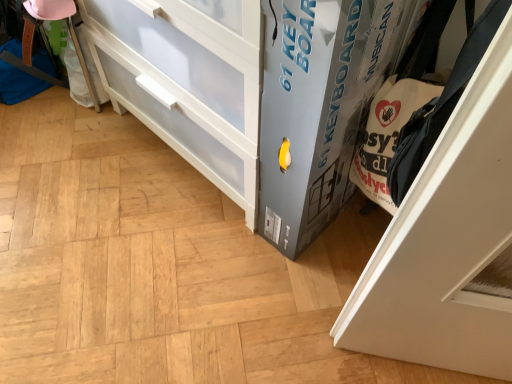
Question: Is white matte door at right at the right side of gray cardboard box at lower right?

Choices:
 (A) yes
 (B) no

Answer: (A)

Question: Does white matte door at right have a greater width compared to gray cardboard box at lower right?

Choices:
 (A) no
 (B) yes

Answer: (A)

Question: Considering the relative positions of white matte door at right and gray cardboard box at lower right in the image provided, is white matte door at right in front of gray cardboard box at lower right?

Choices:
 (A) no
 (B) yes

Answer: (B)

Question: Considering the relative sizes of white matte door at right and gray cardboard box at lower right in the image provided, is white matte door at right smaller than gray cardboard box at lower right?

Choices:
 (A) yes
 (B) no

Answer: (A)

Question: Does white matte door at right turn towards gray cardboard box at lower right?

Choices:
 (A) no
 (B) yes

Answer: (A)

Question: Is white matte door at right thinner than gray cardboard box at lower right?

Choices:
 (A) no
 (B) yes

Answer: (B)

Question: From a real-world perspective, is gray cardboard box at lower right located higher than white matte door at right?

Choices:
 (A) yes
 (B) no

Answer: (B)

Question: Is gray cardboard box at lower right behind white matte door at right?

Choices:
 (A) no
 (B) yes

Answer: (B)

Question: Can you confirm if gray cardboard box at lower right is wider than white matte door at right?

Choices:
 (A) yes
 (B) no

Answer: (A)

Question: Does gray cardboard box at lower right have a lesser width compared to white matte door at right?

Choices:
 (A) yes
 (B) no

Answer: (B)

Question: Is white matte door at right inside gray cardboard box at lower right?

Choices:
 (A) no
 (B) yes

Answer: (A)

Question: Is gray cardboard box at lower right oriented towards white matte door at right?

Choices:
 (A) no
 (B) yes

Answer: (A)

Question: From the image's perspective, is white matte door at right located above or below gray cardboard box at lower right?

Choices:
 (A) above
 (B) below

Answer: (B)